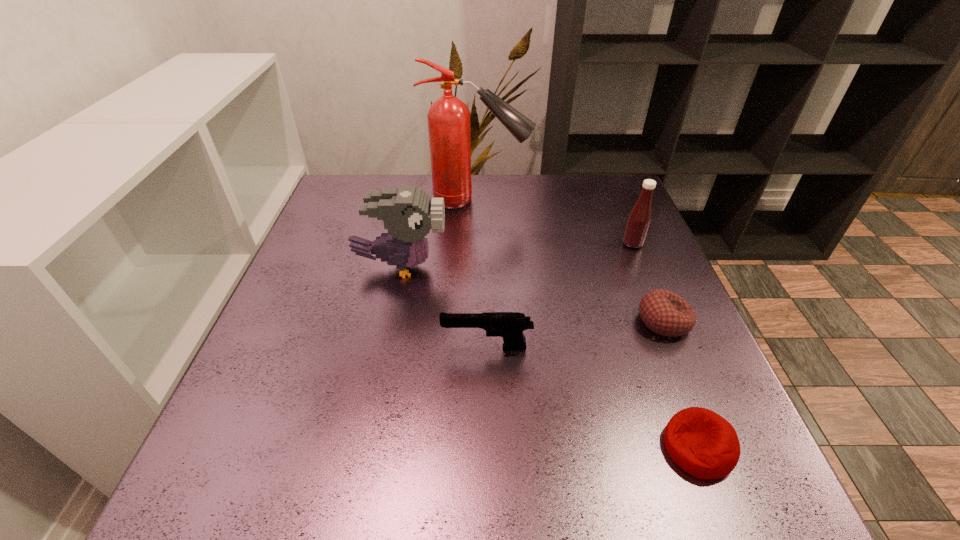
Identify the location of free space located 0.140m on the left of the second farthest object. (565, 244).

Where is `vacant space situated on the front-facing side of the fifth farthest object`? This screenshot has height=540, width=960. vacant space situated on the front-facing side of the fifth farthest object is located at coordinates (390, 348).

At what (x,y) coordinates should I click in order to perform the action: click on vacant space located 0.260m on the front-facing side of the fifth farthest object. Please return your answer as a coordinate pair (x, y). This screenshot has height=540, width=960. Looking at the image, I should click on (306, 348).

Find the location of a particular element. The height and width of the screenshot is (540, 960). free space located on the front-facing side of the fifth farthest object is located at coordinates (364, 348).

Locate an element on the screen. blank space located on the back of the farther beanbag is located at coordinates (617, 208).

Where is `vacant position located on the seat area of the nearer beanbag`? vacant position located on the seat area of the nearer beanbag is located at coordinates click(543, 448).

Where is `free point located 0.230m on the seat area of the nearer beanbag`? free point located 0.230m on the seat area of the nearer beanbag is located at coordinates (518, 448).

Locate an element on the screen. Image resolution: width=960 pixels, height=540 pixels. vacant space located on the seat area of the nearer beanbag is located at coordinates (601, 448).

What are the coordinates of `object that is positioned at the far edge` in the screenshot? It's located at (448, 118).

Identify the location of object located in the near edge section of the desktop. (701, 442).